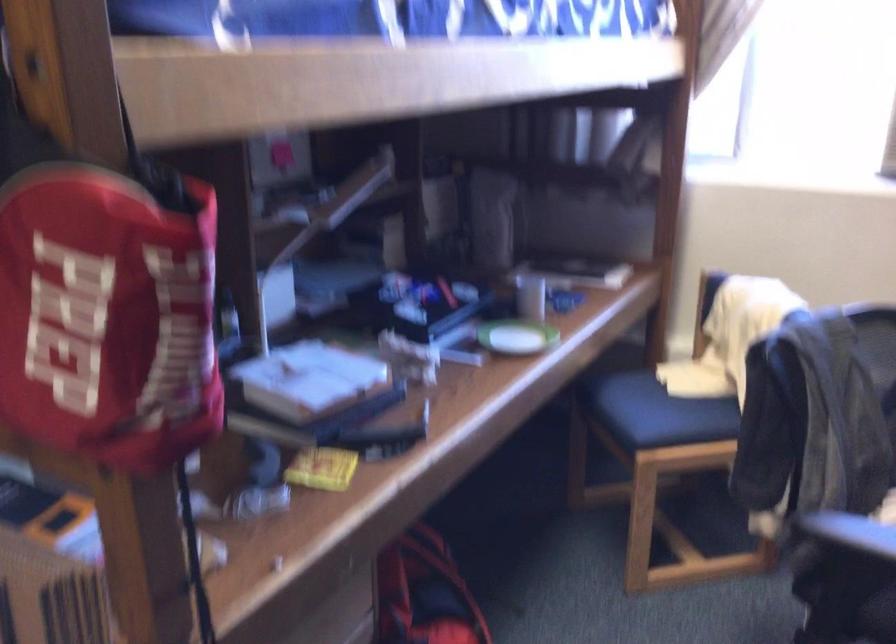
Find the location of a particular element. The image size is (896, 644). red prep bag is located at coordinates (107, 317).